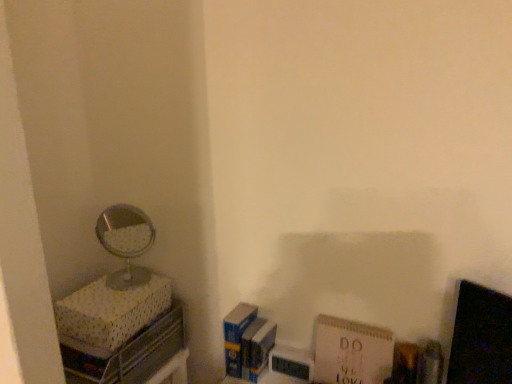
Locate an element on the screen. shiny silver mirror at left is located at coordinates (126, 242).

At what (x,y) coordinates should I click in order to perform the action: click on shiny silver mirror at left. Please return your answer as a coordinate pair (x, y). Looking at the image, I should click on (126, 242).

In terms of height, does white paper at lower right, marked as the second paperback book in a left-to-right arrangement, look taller or shorter compared to shiny silver mirror at left?

In the image, white paper at lower right, marked as the second paperback book in a left-to-right arrangement, appears to be shorter than shiny silver mirror at left.

From the picture: Is white paper at lower right, which is the first paperback book in right-to-left order, further to camera compared to shiny silver mirror at left?

No, the depth of white paper at lower right, which is the first paperback book in right-to-left order, is less than that of shiny silver mirror at left.

Which is more to the right, white paper at lower right, marked as the second paperback book in a left-to-right arrangement, or shiny silver mirror at left?

white paper at lower right, marked as the second paperback book in a left-to-right arrangement, is more to the right.

In the scene shown: Is shiny silver mirror at left to the left or to the right of white paper at lower right, which is the first paperback book in right-to-left order, in the image?

From the image, it's evident that shiny silver mirror at left is to the left of white paper at lower right, which is the first paperback book in right-to-left order.

Is shiny silver mirror at left located outside white paper at lower right, marked as the second paperback book in a left-to-right arrangement?

shiny silver mirror at left lies outside white paper at lower right, marked as the second paperback book in a left-to-right arrangement,'s area.

From a real-world perspective, who is located higher, shiny silver mirror at left or white paper at lower right, which is the first paperback book in right-to-left order?

shiny silver mirror at left.

Can you confirm if shiny silver mirror at left is bigger than white paper at lower right, which is the first paperback book in right-to-left order?

Yes.

Is white paper at lower right, marked as the second paperback book in a left-to-right arrangement, oriented away from blue matte paperback book at lower center, which is the 1th paperback book in left-to-right order?

No, white paper at lower right, marked as the second paperback book in a left-to-right arrangement, is not facing away from blue matte paperback book at lower center, which is the 1th paperback book in left-to-right order.

Does white paper at lower right, which is the first paperback book in right-to-left order, lie in front of blue matte paperback book at lower center, which is the 1th paperback book in left-to-right order?

Yes, white paper at lower right, which is the first paperback book in right-to-left order, is closer to the camera.

From the picture: How distant is white paper at lower right, which is the first paperback book in right-to-left order, from blue matte paperback book at lower center, which is the 1th paperback book in left-to-right order?

white paper at lower right, which is the first paperback book in right-to-left order, is 10.64 inches from blue matte paperback book at lower center, which is the 1th paperback book in left-to-right order.

Is white paper at lower right, marked as the second paperback book in a left-to-right arrangement, at the left side of blue matte paperback book at lower center, arranged as the 2th paperback book when viewed from the right?

In fact, white paper at lower right, marked as the second paperback book in a left-to-right arrangement, is to the right of blue matte paperback book at lower center, arranged as the 2th paperback book when viewed from the right.

Which of these two, blue matte paperback book at lower center, arranged as the 2th paperback book when viewed from the right, or shiny silver mirror at left, is thinner?

blue matte paperback book at lower center, arranged as the 2th paperback book when viewed from the right.

Is point (238, 351) closer or farther from the camera than point (106, 239)?

Point (238, 351).

Which is more to the right, blue matte paperback book at lower center, which is the 1th paperback book in left-to-right order, or shiny silver mirror at left?

Positioned to the right is blue matte paperback book at lower center, which is the 1th paperback book in left-to-right order.

From the image's perspective, between blue matte paperback book at lower center, which is the 1th paperback book in left-to-right order, and shiny silver mirror at left, who is located below?

blue matte paperback book at lower center, which is the 1th paperback book in left-to-right order, from the image's perspective.

Is shiny silver mirror at left to the right of blue matte paperback book at lower center, which is the 1th paperback book in left-to-right order, from the viewer's perspective?

No, shiny silver mirror at left is not to the right of blue matte paperback book at lower center, which is the 1th paperback book in left-to-right order.

Is shiny silver mirror at left shorter than blue matte paperback book at lower center, which is the 1th paperback book in left-to-right order?

No.

Is blue matte paperback book at lower center, arranged as the 2th paperback book when viewed from the right, spatially inside white paper at lower right, which is the first paperback book in right-to-left order, or outside of it?

blue matte paperback book at lower center, arranged as the 2th paperback book when viewed from the right, exists outside the volume of white paper at lower right, which is the first paperback book in right-to-left order.

From a real-world perspective, does blue matte paperback book at lower center, arranged as the 2th paperback book when viewed from the right, stand above white paper at lower right, marked as the second paperback book in a left-to-right arrangement?

No, from a real-world perspective, blue matte paperback book at lower center, arranged as the 2th paperback book when viewed from the right, is not over white paper at lower right, marked as the second paperback book in a left-to-right arrangement

Are blue matte paperback book at lower center, which is the 1th paperback book in left-to-right order, and white paper at lower right, which is the first paperback book in right-to-left order, beside each other?

No, blue matte paperback book at lower center, which is the 1th paperback book in left-to-right order, is not touching white paper at lower right, which is the first paperback book in right-to-left order.

From the image's perspective, relative to white paper at lower right, marked as the second paperback book in a left-to-right arrangement, is blue matte paperback book at lower center, which is the 1th paperback book in left-to-right order, above or below?

Clearly, from the image's perspective, blue matte paperback book at lower center, which is the 1th paperback book in left-to-right order, is above white paper at lower right, marked as the second paperback book in a left-to-right arrangement.

Image resolution: width=512 pixels, height=384 pixels. I want to click on the 1st paperback book directly beneath the shiny silver mirror at left (from a real-world perspective), so click(x=351, y=352).

Which paperback book is the 2nd one when counting from the right side of the shiny silver mirror at left? Please provide its 2D coordinates.

[(351, 352)]

Based on their spatial positions, is white paper at lower right, which is the first paperback book in right-to-left order, or blue matte paperback book at lower center, arranged as the 2th paperback book when viewed from the right, closer to shiny silver mirror at left?

blue matte paperback book at lower center, arranged as the 2th paperback book when viewed from the right.

Considering their positions, is blue matte paperback book at lower center, arranged as the 2th paperback book when viewed from the right, positioned closer to white paper at lower right, marked as the second paperback book in a left-to-right arrangement, than shiny silver mirror at left?

Based on the image, blue matte paperback book at lower center, arranged as the 2th paperback book when viewed from the right, appears to be nearer to white paper at lower right, marked as the second paperback book in a left-to-right arrangement.

Considering their positions, is white paper at lower right, marked as the second paperback book in a left-to-right arrangement, positioned further to blue matte paperback book at lower center, arranged as the 2th paperback book when viewed from the right, than shiny silver mirror at left?

Based on the image, shiny silver mirror at left appears to be further to blue matte paperback book at lower center, arranged as the 2th paperback book when viewed from the right.

Which object lies further to the anchor point white paper at lower right, marked as the second paperback book in a left-to-right arrangement, shiny silver mirror at left or blue matte paperback book at lower center, which is the 1th paperback book in left-to-right order?

shiny silver mirror at left lies further to white paper at lower right, marked as the second paperback book in a left-to-right arrangement, than the other object.

Based on their spatial positions, is shiny silver mirror at left or white paper at lower right, which is the first paperback book in right-to-left order, further from blue matte paperback book at lower center, which is the 1th paperback book in left-to-right order?

shiny silver mirror at left lies further to blue matte paperback book at lower center, which is the 1th paperback book in left-to-right order, than the other object.

In the scene shown: When comparing their distances from shiny silver mirror at left, does blue matte paperback book at lower center, which is the 1th paperback book in left-to-right order, or white paper at lower right, which is the first paperback book in right-to-left order, seem further?

white paper at lower right, which is the first paperback book in right-to-left order.

This screenshot has width=512, height=384. Find the location of `paperback book situated between shiny silver mirror at left and white paper at lower right, which is the first paperback book in right-to-left order, from left to right`. paperback book situated between shiny silver mirror at left and white paper at lower right, which is the first paperback book in right-to-left order, from left to right is located at coordinates (236, 336).